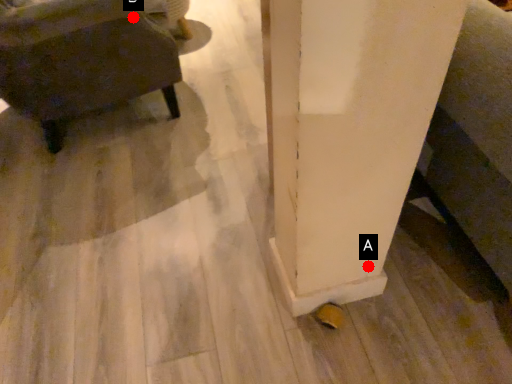
Question: Two points are circled on the image, labeled by A and B beside each circle. Which of the following is the farthest from the observer?

Choices:
 (A) A is further
 (B) B is further

Answer: (B)